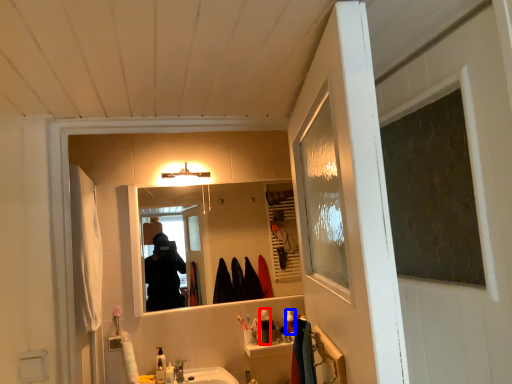
Question: Which object appears farthest to the camera in this image, toiletry (highlighted by a red box) or toiletry (highlighted by a blue box)?

Choices:
 (A) toiletry
 (B) toiletry

Answer: (B)